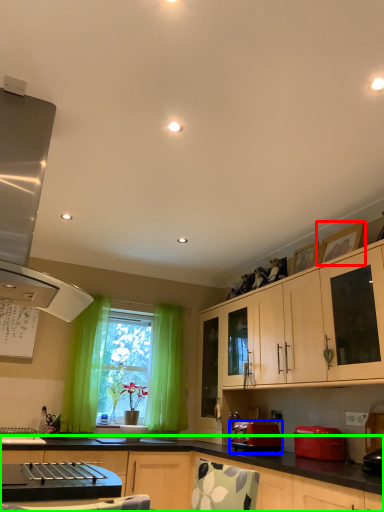
Question: Which is farther away from picture frame (highlighted by a red box)? toaster (highlighted by a blue box) or cabinetry (highlighted by a green box)?

Choices:
 (A) toaster
 (B) cabinetry

Answer: (B)